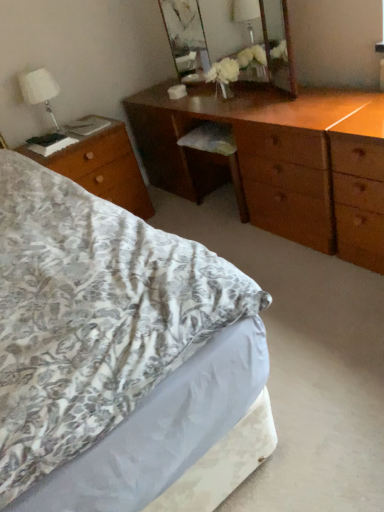
Question: Considering the positions of wooden desk at left and shiny brown dresser at center in the image, is wooden desk at left taller or shorter than shiny brown dresser at center?

Choices:
 (A) tall
 (B) short

Answer: (B)

Question: Would you say wooden desk at left is inside or outside shiny brown dresser at center?

Choices:
 (A) inside
 (B) outside

Answer: (B)

Question: Which object is positioned farthest from the white fabric lampshade at upper left?

Choices:
 (A) shiny brown dresser at center
 (B) wooden mirror at upper center
 (C) floral fabric bed at lower left
 (D) wooden desk at left

Answer: (C)

Question: Based on their relative distances, which object is nearer to the shiny brown dresser at center?

Choices:
 (A) white fabric lampshade at upper left
 (B) wooden mirror at upper center
 (C) wooden desk at left
 (D) floral fabric bed at lower left

Answer: (B)